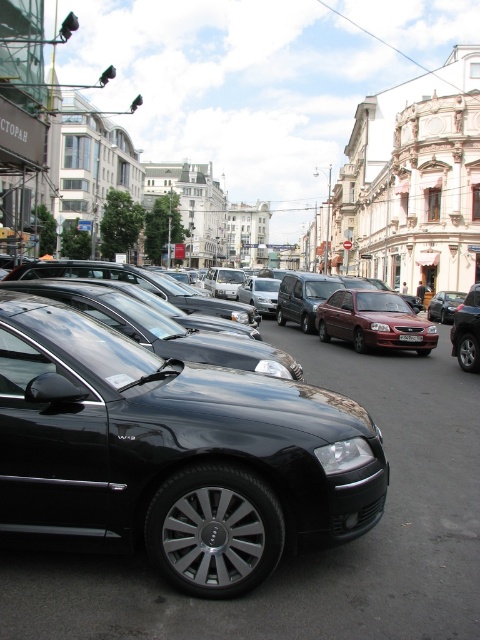
Question: Among these points, which one is farthest from the camera?

Choices:
 (A) [414, 339]
 (B) [111, 497]

Answer: (A)

Question: Which point is closer to the camera?

Choices:
 (A) white plastic license plate at center
 (B) glossy black car at center

Answer: (B)

Question: Can you confirm if glossy black car at center is positioned above white plastic license plate at center?

Choices:
 (A) no
 (B) yes

Answer: (A)

Question: Can you confirm if glossy black car at center is thinner than white plastic license plate at center?

Choices:
 (A) no
 (B) yes

Answer: (A)

Question: Which object is farther from the camera taking this photo?

Choices:
 (A) white plastic license plate at center
 (B) glossy black car at center

Answer: (A)

Question: Is glossy black car at center thinner than white plastic license plate at center?

Choices:
 (A) yes
 (B) no

Answer: (B)